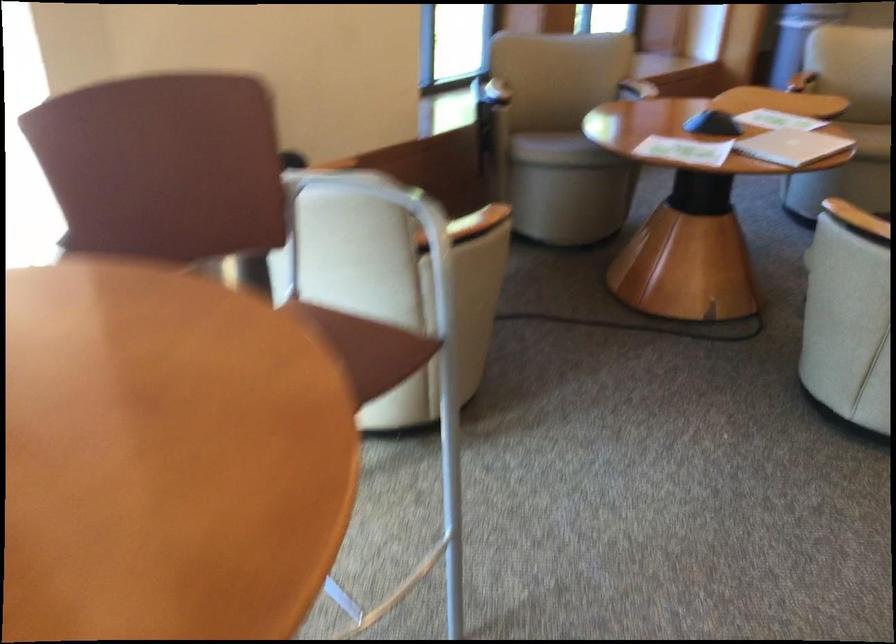
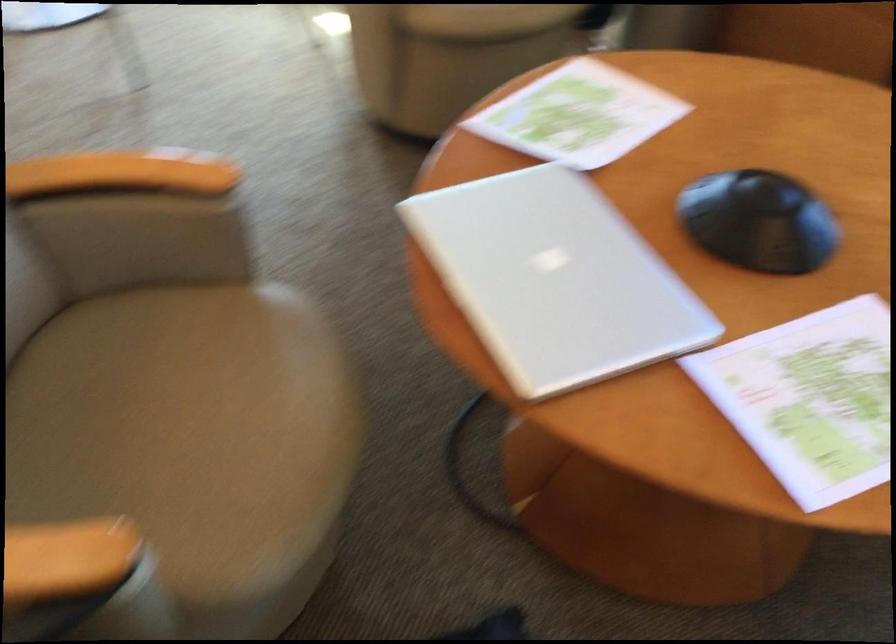
The point at [661,145] is marked in the first image. Where is the corresponding point in the second image?

(579, 115)